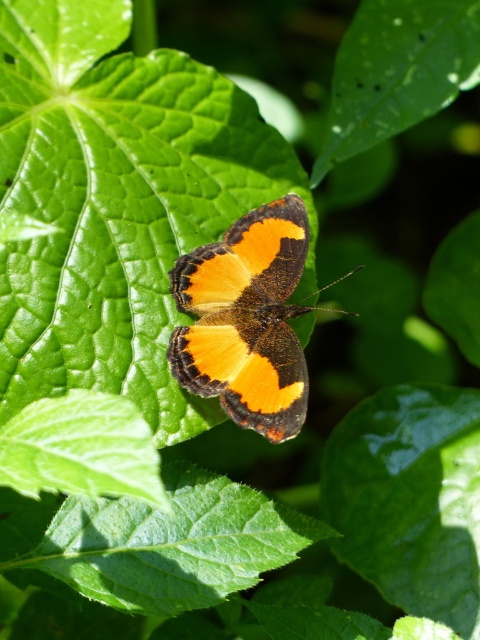
From the picture: Which is more to the right, orange matte butterfly at center or glossy green leaf at upper center?

glossy green leaf at upper center

Between point (224, 304) and point (343, 52), which one is positioned behind?

The point (343, 52) is more distant.

Find the location of a particular element. orange matte butterfly at center is located at coordinates (245, 320).

Can you confirm if green smooth leaf at center is taller than orange matte butterfly at center?

Incorrect, green smooth leaf at center's height is not larger of orange matte butterfly at center's.

Which is below, green smooth leaf at center or orange matte butterfly at center?

Positioned lower is green smooth leaf at center.

Is point (166, 531) positioned in front of point (173, 348)?

Yes, point (166, 531) is closer to viewer.

This screenshot has width=480, height=640. I want to click on green smooth leaf at center, so click(x=158, y=541).

Is green smooth leaf at center wider than glossy green leaf at upper center?

Indeed, green smooth leaf at center has a greater width compared to glossy green leaf at upper center.

Does green smooth leaf at center have a lesser height compared to glossy green leaf at upper center?

Indeed, green smooth leaf at center has a lesser height compared to glossy green leaf at upper center.

You are a GUI agent. You are given a task and a screenshot of the screen. Output one action in this format:
    pyautogui.click(x=<x>, y=<y>)
    Task: Click on the green smooth leaf at center
    
    Given the screenshot: What is the action you would take?
    pyautogui.click(x=158, y=541)